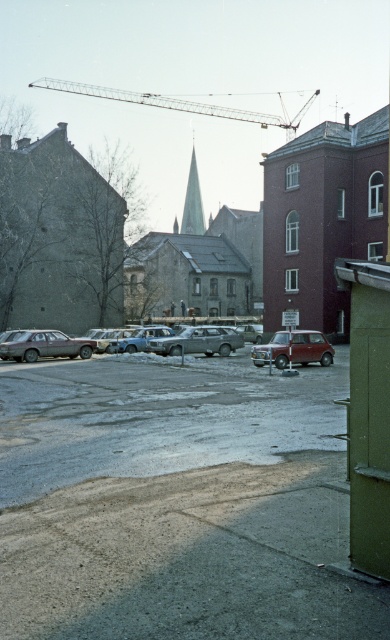
You are standing at the point with coordinates point [180,104] in the image. What object is located at that point?

The point [180,104] corresponds to the metallic gray crane at upper center.

You are standing at the origin point of the coordinate system in this parking lot scene. The origin is at the bottom left corner of the image. You need to locate the matte gray car at lower left. What are its coordinates?

The coordinates of the matte gray car at lower left are at point (44, 346).